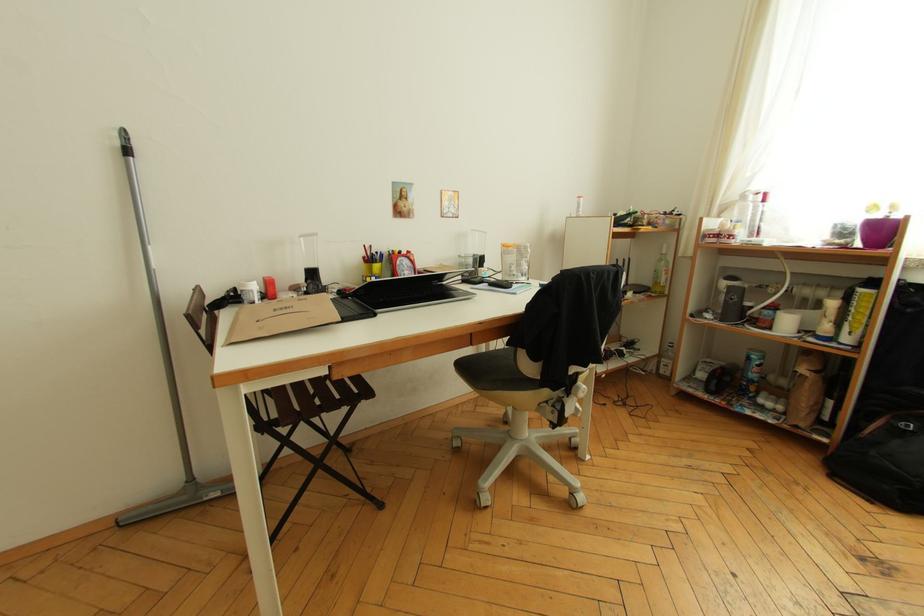
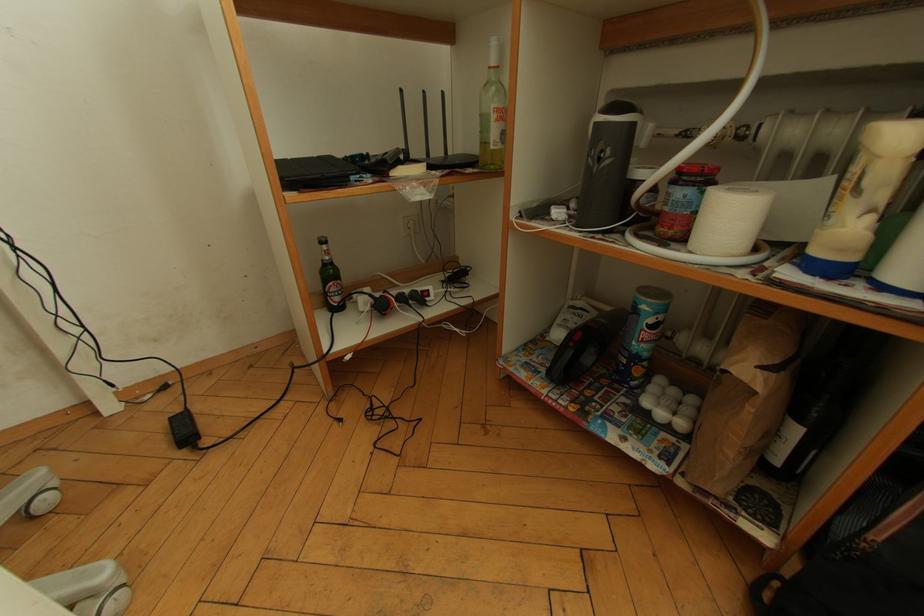
What movement of the cameraman would produce the second image?

The movement direction of the cameraman is right, forward.